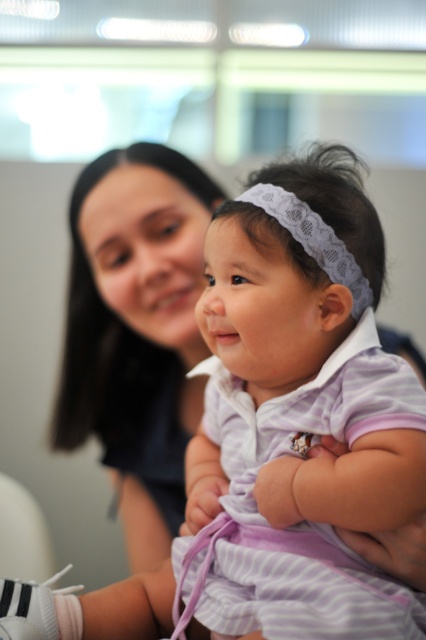
In the scene shown: Between purple striped dress at center and white lace headband at center, which one has less height?

With less height is white lace headband at center.

Which is more to the right, purple striped dress at center or white lace headband at center?

white lace headband at center is more to the right.

Where is `purple striped dress at center`? This screenshot has width=426, height=640. purple striped dress at center is located at coordinates (299, 416).